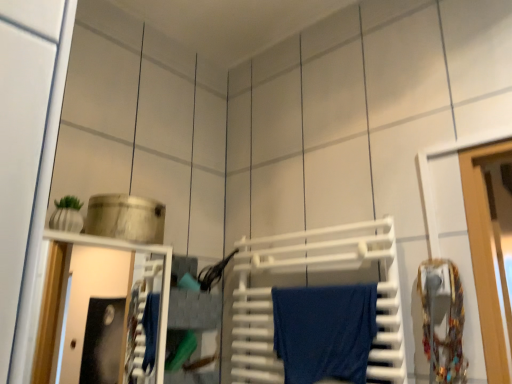
What do you see at coordinates (324, 331) in the screenshot? Image resolution: width=512 pixels, height=384 pixels. I see `blue cotton towel at center` at bounding box center [324, 331].

Measure the distance between blue cotton towel at center and camera.

blue cotton towel at center is 1.09 meters away from camera.

Identify the location of blue cotton towel at center. The width and height of the screenshot is (512, 384). (324, 331).

Locate an element on the screen. This screenshot has height=384, width=512. white plastic towel rack at center is located at coordinates (316, 275).

What do you see at coordinates (316, 275) in the screenshot?
I see `white plastic towel rack at center` at bounding box center [316, 275].

Locate an element on the screen. blue cotton towel at center is located at coordinates (324, 331).

Can you confirm if white plastic towel rack at center is positioned to the right of blue cotton towel at center?

No.

Does white plastic towel rack at center lie behind blue cotton towel at center?

That is False.

Does point (279, 262) come in front of point (372, 297)?

No, (279, 262) is behind (372, 297).

From the image's perspective, relative to blue cotton towel at center, is white plastic towel rack at center above or below?

From the image's perspective, white plastic towel rack at center appears above blue cotton towel at center.

From a real-world perspective, which object stands above the other?

white plastic towel rack at center is physically above.

Which object is thinner, white plastic towel rack at center or blue cotton towel at center?

With smaller width is white plastic towel rack at center.

In the scene shown: Can you confirm if white plastic towel rack at center is shorter than blue cotton towel at center?

In fact, white plastic towel rack at center may be taller than blue cotton towel at center.

Looking at the image, does white plastic towel rack at center seem bigger or smaller compared to blue cotton towel at center?

white plastic towel rack at center is bigger than blue cotton towel at center.

Looking at this image, would you say white plastic towel rack at center is outside blue cotton towel at center?

Actually, white plastic towel rack at center is at least partially inside blue cotton towel at center.

Is white plastic towel rack at center beside blue cotton towel at center?

Yes, white plastic towel rack at center and blue cotton towel at center clearly make contact.

Does white plastic towel rack at center turn towards blue cotton towel at center?

Yes, white plastic towel rack at center is facing blue cotton towel at center.

How different are the orientations of white plastic towel rack at center and blue cotton towel at center in degrees?

There is a 0.000713-degree angle between the facing directions of white plastic towel rack at center and blue cotton towel at center.

I want to click on bath towel that appears on the right of white plastic towel rack at center, so click(x=324, y=331).

Does blue cotton towel at center appear on the right side of white plastic towel rack at center?

Correct, you'll find blue cotton towel at center to the right of white plastic towel rack at center.

Is blue cotton towel at center further to the viewer compared to white plastic towel rack at center?

Yes, it is behind white plastic towel rack at center.

Which point is more forward, (311, 303) or (277, 376)?

The point (311, 303) is in front.

From the image's perspective, is blue cotton towel at center positioned above or below white plastic towel rack at center?

Based on their image positions, blue cotton towel at center is located beneath white plastic towel rack at center.

From a real-world perspective, which is physically above, blue cotton towel at center or white plastic towel rack at center?

white plastic towel rack at center, from a real-world perspective.

Considering the relative sizes of blue cotton towel at center and white plastic towel rack at center in the image provided, is blue cotton towel at center wider than white plastic towel rack at center?

Indeed, blue cotton towel at center has a greater width compared to white plastic towel rack at center.

Considering the relative sizes of blue cotton towel at center and white plastic towel rack at center in the image provided, is blue cotton towel at center shorter than white plastic towel rack at center?

Yes, blue cotton towel at center is shorter than white plastic towel rack at center.

Which of these two, blue cotton towel at center or white plastic towel rack at center, is bigger?

white plastic towel rack at center is bigger.

Is white plastic towel rack at center inside blue cotton towel at center?

Yes, white plastic towel rack at center is a part of blue cotton towel at center.

Is blue cotton towel at center beside white plastic towel rack at center?

Yes.

Is white plastic towel rack at center at the back of blue cotton towel at center?

Yes, blue cotton towel at center is positioned with its back facing white plastic towel rack at center.

From the picture: Can you tell me how much blue cotton towel at center and white plastic towel rack at center differ in facing direction?

0.000713 degrees.

Measure the distance between blue cotton towel at center and white plastic towel rack at center.

blue cotton towel at center is 3.92 inches from white plastic towel rack at center.

You are a GUI agent. You are given a task and a screenshot of the screen. Output one action in this format:
    pyautogui.click(x=<x>, y=<y>)
    Task: Click on the bath towel that appears below the white plastic towel rack at center (from the image's perspective)
    The height and width of the screenshot is (384, 512).
    Given the screenshot: What is the action you would take?
    pyautogui.click(x=324, y=331)

Locate an element on the screen. The height and width of the screenshot is (384, 512). wide that is in front of the blue cotton towel at center is located at coordinates pos(316,275).

You are a GUI agent. You are given a task and a screenshot of the screen. Output one action in this format:
    pyautogui.click(x=<x>, y=<y>)
    Task: Click on the bath towel below the white plastic towel rack at center (from the image's perspective)
    The image size is (512, 384).
    Given the screenshot: What is the action you would take?
    pyautogui.click(x=324, y=331)